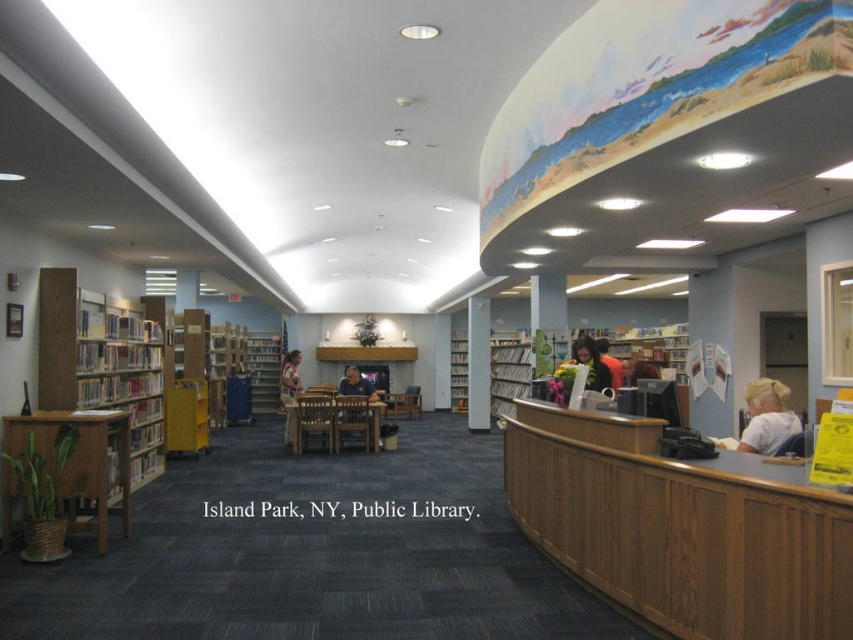
Question: Which point is farther to the camera?

Choices:
 (A) wooden bookshelf at center
 (B) dark blue shirt at center
 (C) white matte shirt at lower right
 (D) light brown wooden chair at center

Answer: (D)

Question: Does wooden bookshelf at center have a lesser width compared to orange fabric bag at center?

Choices:
 (A) no
 (B) yes

Answer: (A)

Question: Does orange fabric bag at center have a smaller size compared to smooth brown hair at center?

Choices:
 (A) no
 (B) yes

Answer: (B)

Question: Is wooden bookshelf at left further to the viewer compared to wooden bookshelf at center?

Choices:
 (A) yes
 (B) no

Answer: (A)

Question: Considering the real-world distances, which object is farthest from the white matte shirt at lower right?

Choices:
 (A) wooden chair at center
 (B) white glossy pillar at center
 (C) light brown wooden chair at center
 (D) wooden bookshelf at center

Answer: (B)

Question: Based on their relative distances, which object is nearer to the light brown wooden chair at center?

Choices:
 (A) orange fabric bag at center
 (B) metallic silver bookshelf at center
 (C) wooden bookshelf at center

Answer: (C)